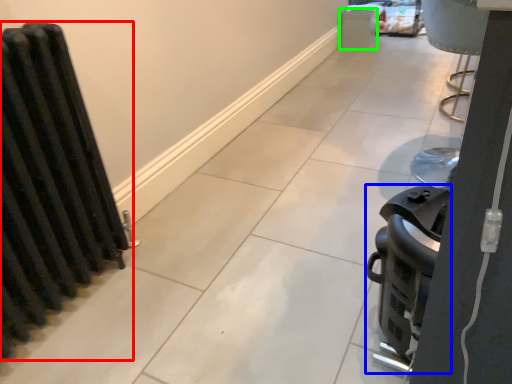
Question: Considering the real-world distances, which object is farthest from radiator (highlighted by a red box)? appliance (highlighted by a blue box) or appliance (highlighted by a green box)?

Choices:
 (A) appliance
 (B) appliance

Answer: (B)